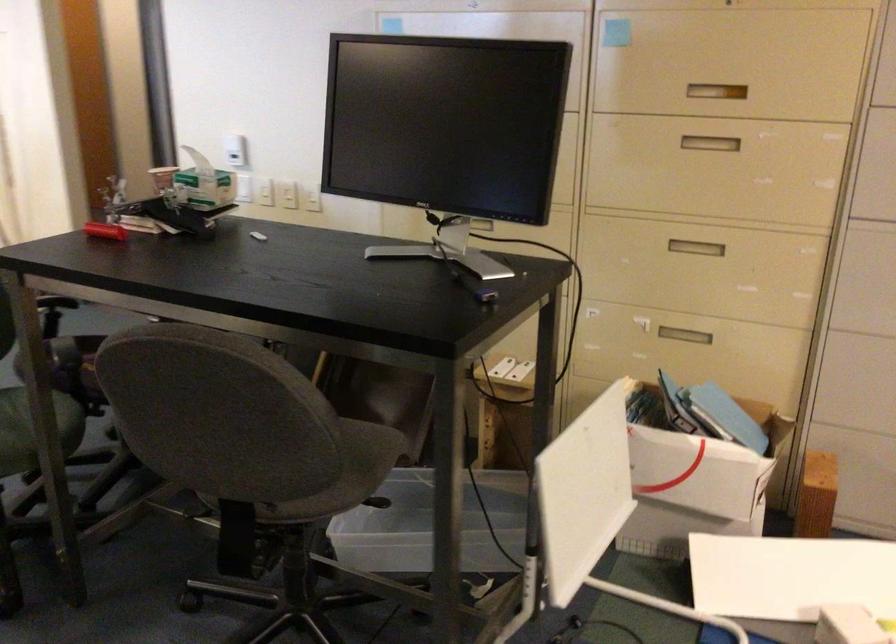
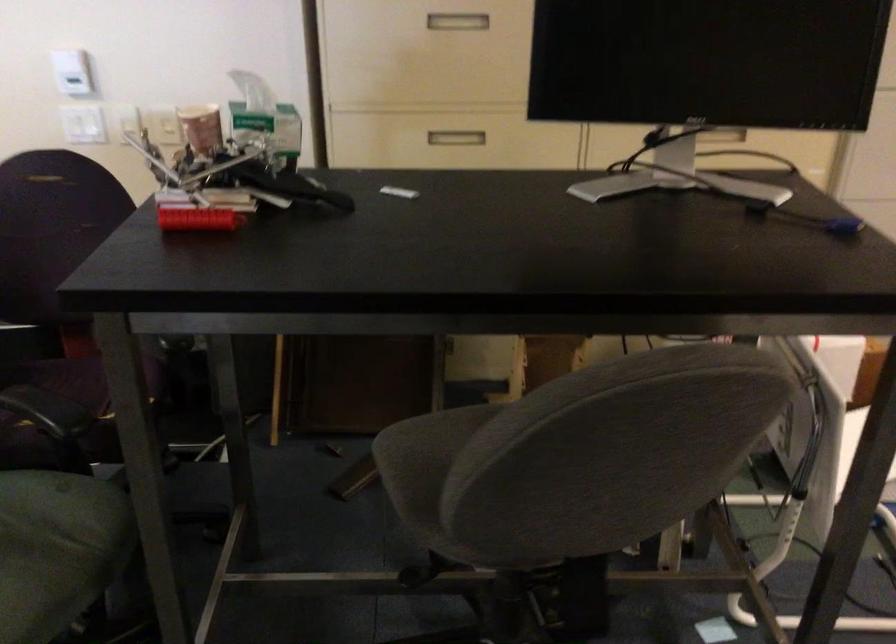
Which direction would the cameraman need to move to produce the second image?

The cameraman moved toward left, forward.